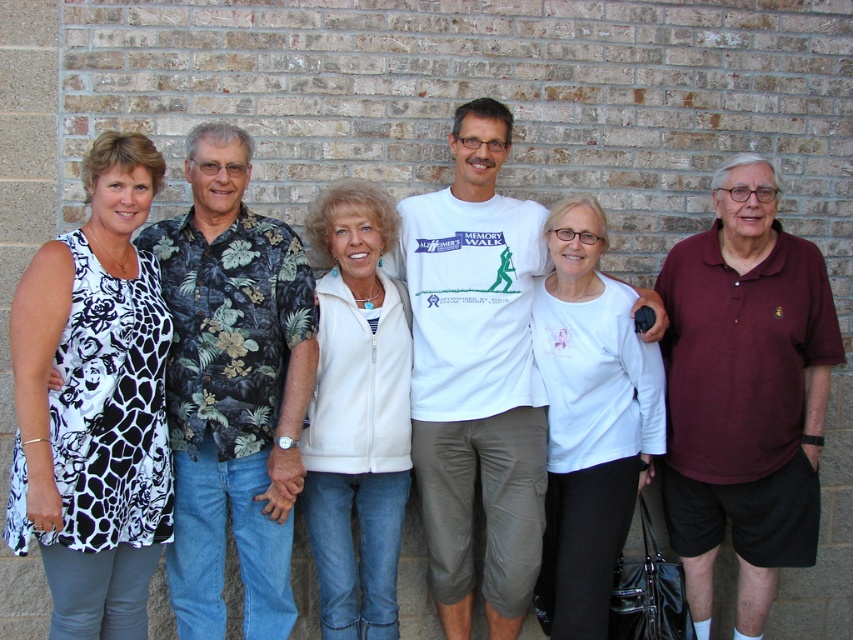
Question: Which of the following is the farthest from the observer?

Choices:
 (A) white fleece vest at center
 (B) maroon polo shirt at right
 (C) white matte shirt at center

Answer: (B)

Question: Can you confirm if maroon polo shirt at right is positioned below white cotton shirt at center?

Choices:
 (A) yes
 (B) no

Answer: (A)

Question: Does maroon polo shirt at right come behind white matte shirt at center?

Choices:
 (A) no
 (B) yes

Answer: (B)

Question: Which point is closer to the camera?

Choices:
 (A) white matte shirt at center
 (B) black printed fabric dress at left
 (C) maroon polo shirt at right
 (D) white cotton shirt at center

Answer: (B)

Question: Which of the following is the closest to the observer?

Choices:
 (A) (573, 490)
 (B) (679, 403)

Answer: (A)

Question: Can you confirm if white cotton shirt at center is positioned above white fleece vest at center?

Choices:
 (A) no
 (B) yes

Answer: (B)